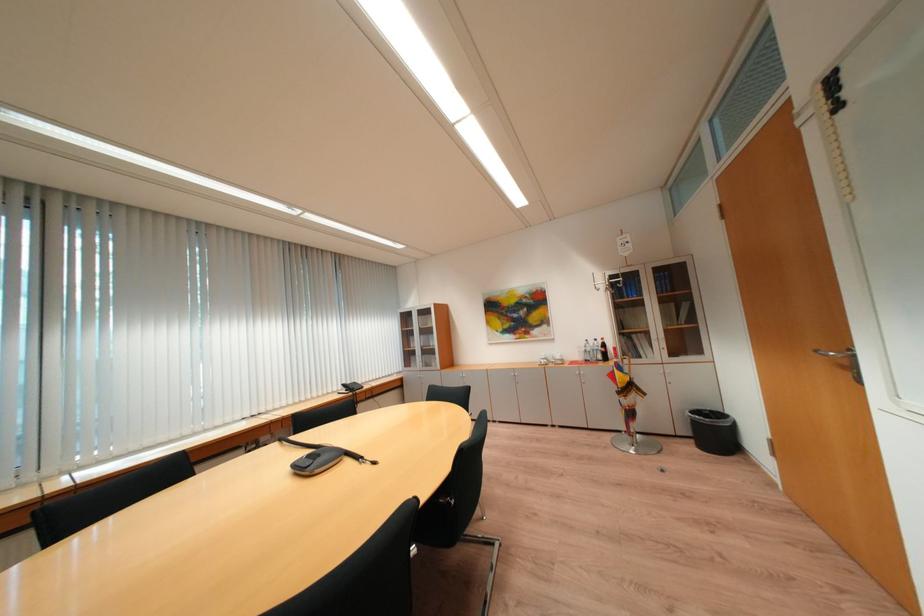
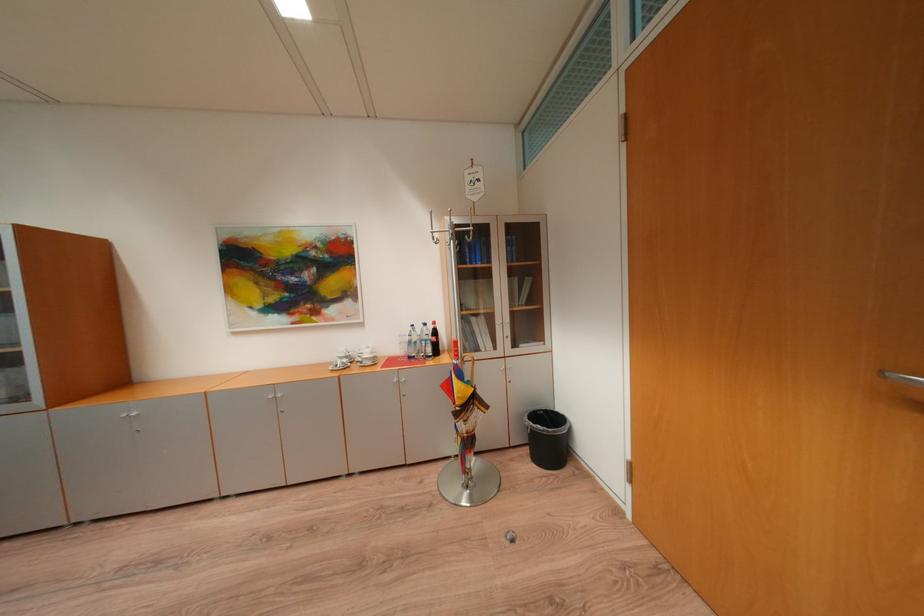
The point at (594,353) is marked in the first image. Where is the corresponding point in the second image?

(419, 344)